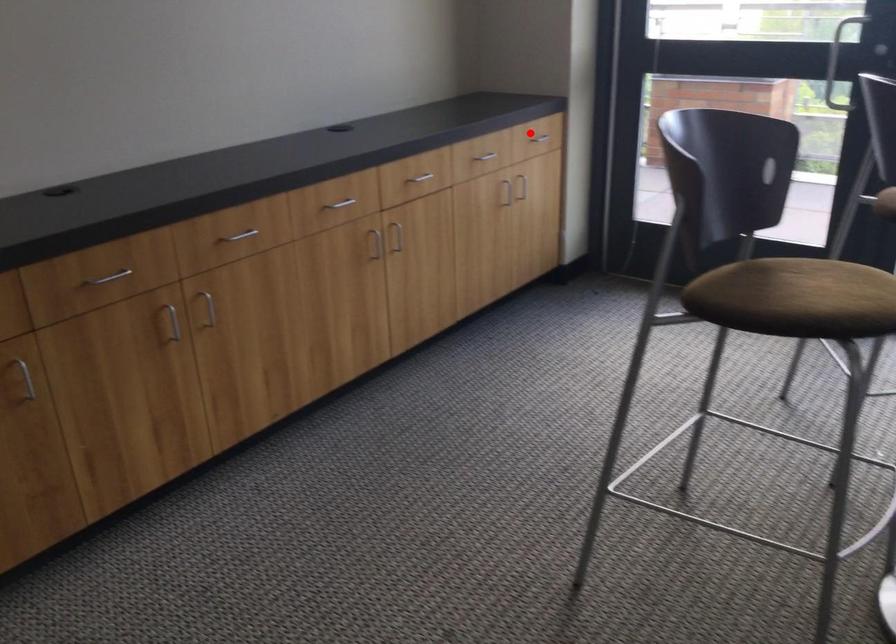
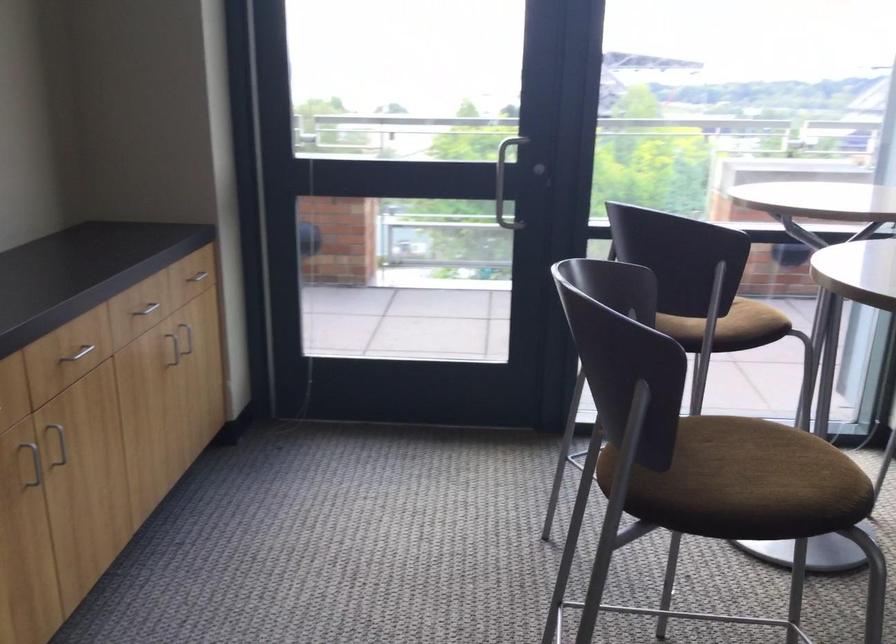
In the second image, find the point that corresponds to the highlighted location in the first image.

(194, 279)